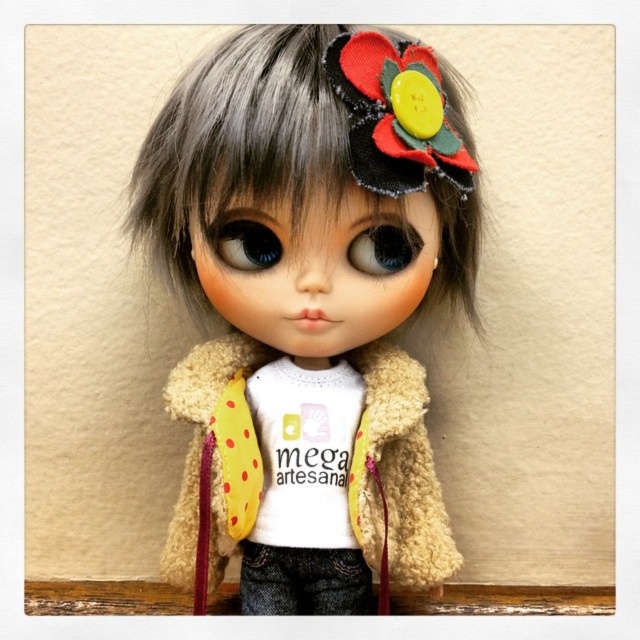
Is fuzzy beige coat at center to the right of white fabric shirt at center from the viewer's perspective?

Correct, you'll find fuzzy beige coat at center to the right of white fabric shirt at center.

Does fuzzy beige coat at center have a lesser width compared to white fabric shirt at center?

No, fuzzy beige coat at center is not thinner than white fabric shirt at center.

Locate an element on the screen. fuzzy beige coat at center is located at coordinates (308, 307).

Locate an element on the screen. The image size is (640, 640). fuzzy beige coat at center is located at coordinates (308, 307).

Does fuzzy beige coat at center appear under wooden ledge at lower center?

Incorrect, fuzzy beige coat at center is not positioned below wooden ledge at lower center.

Does point (369, 397) come farther from viewer compared to point (404, 598)?

No, it is not.

The height and width of the screenshot is (640, 640). I want to click on fuzzy beige coat at center, so click(308, 307).

Between white fabric shirt at center and wooden ledge at lower center, which one appears on the right side from the viewer's perspective?

white fabric shirt at center

Does point (333, 424) lie in front of point (90, 608)?

Yes.

This screenshot has height=640, width=640. What are the coordinates of `white fabric shirt at center` in the screenshot? It's located at (305, 452).

I want to click on white fabric shirt at center, so click(x=305, y=452).